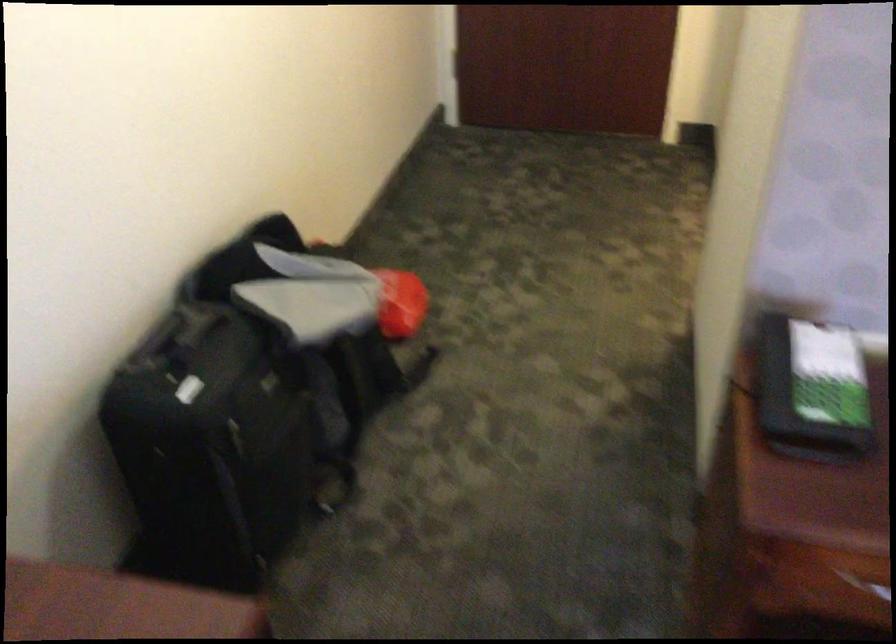
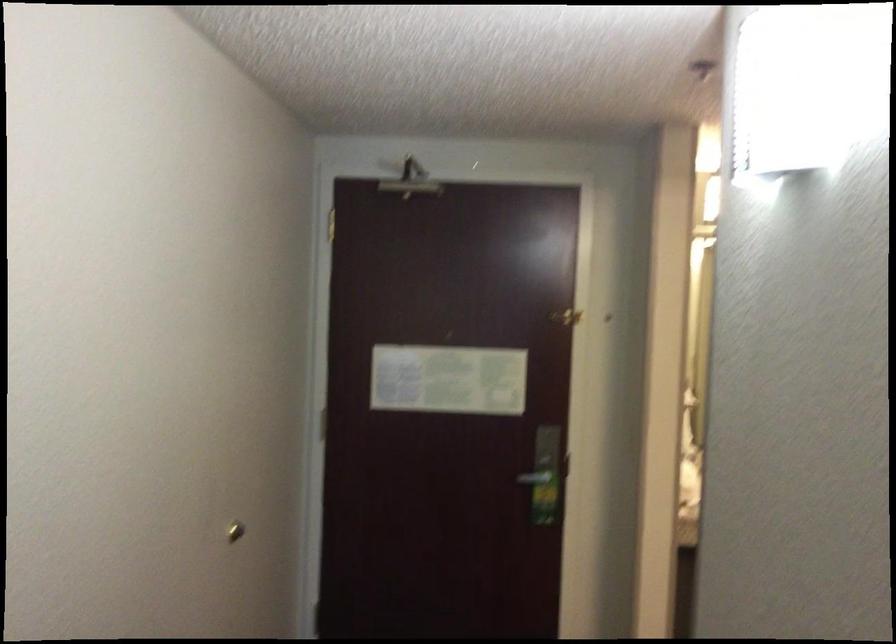
Question: Based on the continuous images, in which direction is the camera rotating? Reply with the corresponding letter.

Choices:
 (A) Left
 (B) Right
 (C) Up
 (D) Down

Answer: (C)